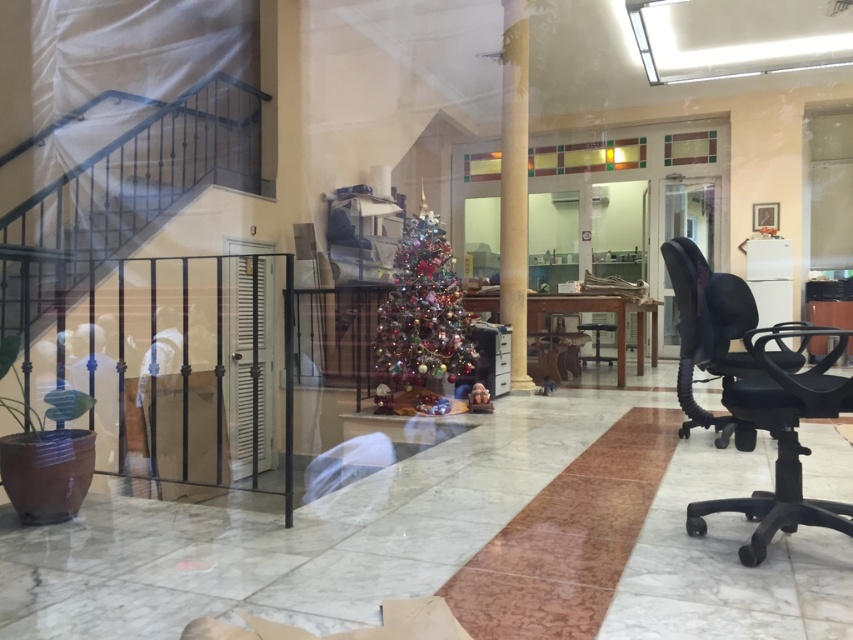
Between shiny metallic christmas tree at center and white marble pillar at center, which one is positioned lower?

Positioned lower is shiny metallic christmas tree at center.

Is point (434, 349) positioned before point (514, 244)?

Yes, point (434, 349) is closer to viewer.

Identify the location of shiny metallic christmas tree at center. The width and height of the screenshot is (853, 640). (422, 316).

Is black matte swivel chair at right above white marble pillar at center?

Actually, black matte swivel chair at right is below white marble pillar at center.

Can you confirm if black matte swivel chair at right is positioned below white marble pillar at center?

Yes, black matte swivel chair at right is below white marble pillar at center.

At what (x,y) coordinates should I click in order to perform the action: click on black matte swivel chair at right. Please return your answer as a coordinate pair (x, y). Image resolution: width=853 pixels, height=640 pixels. Looking at the image, I should click on (780, 436).

You are a GUI agent. You are given a task and a screenshot of the screen. Output one action in this format:
    pyautogui.click(x=<x>, y=<y>)
    Task: Click on the black matte swivel chair at right
    
    Given the screenshot: What is the action you would take?
    pyautogui.click(x=780, y=436)

Can you confirm if black matte swivel chair at right is shorter than shiny metallic christmas tree at center?

Correct, black matte swivel chair at right is not as tall as shiny metallic christmas tree at center.

Measure the distance from black matte swivel chair at right to shiny metallic christmas tree at center.

→ black matte swivel chair at right is 8.00 feet from shiny metallic christmas tree at center.

Does point (845, 502) come in front of point (407, 310)?

Yes, point (845, 502) is closer to viewer.

Where is `black matte swivel chair at right`? The height and width of the screenshot is (640, 853). black matte swivel chair at right is located at coordinates pyautogui.click(x=780, y=436).